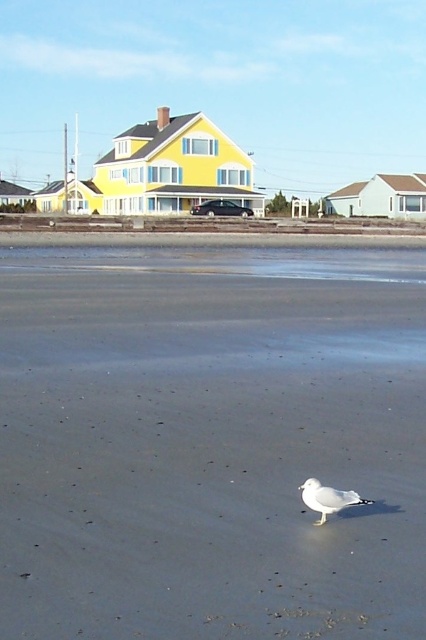
Consider the image. Does smooth gray sand at center appear over white matte bird at center?

Correct, smooth gray sand at center is located above white matte bird at center.

Does point (226, 465) lie in front of point (334, 497)?

No.

Is point (52, 388) more distant than point (319, 486)?

Yes, point (52, 388) is behind point (319, 486).

Identify the location of smooth gray sand at center. Image resolution: width=426 pixels, height=640 pixels. (210, 442).